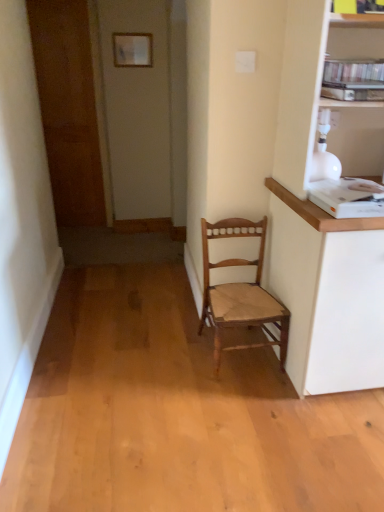
Question: Is wooden chair at center looking in the opposite direction of brown wooden door at left?

Choices:
 (A) no
 (B) yes

Answer: (A)

Question: From the image's perspective, is wooden chair at center over brown wooden door at left?

Choices:
 (A) yes
 (B) no

Answer: (B)

Question: From the image's perspective, is wooden chair at center beneath brown wooden door at left?

Choices:
 (A) yes
 (B) no

Answer: (A)

Question: Is wooden chair at center bigger than brown wooden door at left?

Choices:
 (A) no
 (B) yes

Answer: (A)

Question: Is wooden chair at center far from brown wooden door at left?

Choices:
 (A) yes
 (B) no

Answer: (A)

Question: Considering the relative positions of wooden chair at center and brown wooden door at left in the image provided, is wooden chair at center in front of brown wooden door at left?

Choices:
 (A) no
 (B) yes

Answer: (B)

Question: Does brown wooden door at left have a larger size compared to white paper at upper center?

Choices:
 (A) yes
 (B) no

Answer: (A)

Question: Is white paper at upper center a part of brown wooden door at left?

Choices:
 (A) no
 (B) yes

Answer: (A)

Question: Is brown wooden door at left smaller than white paper at upper center?

Choices:
 (A) no
 (B) yes

Answer: (A)

Question: Is brown wooden door at left not within white paper at upper center?

Choices:
 (A) yes
 (B) no

Answer: (A)

Question: Does brown wooden door at left touch white paper at upper center?

Choices:
 (A) yes
 (B) no

Answer: (B)

Question: Is brown wooden door at left oriented away from white paper at upper center?

Choices:
 (A) no
 (B) yes

Answer: (A)

Question: Is white paper at upper center thinner than wooden chair at center?

Choices:
 (A) yes
 (B) no

Answer: (A)